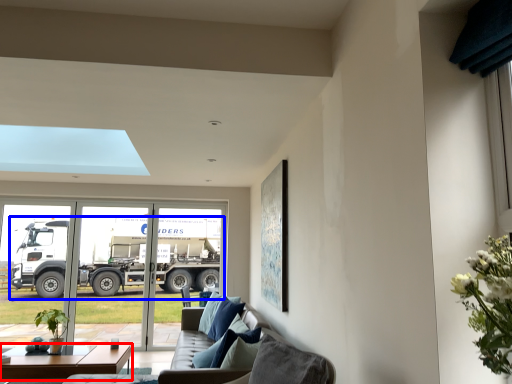
Question: Which of the following is the farthest to the observer, table (highlighted by a red box) or truck (highlighted by a blue box)?

Choices:
 (A) table
 (B) truck

Answer: (B)